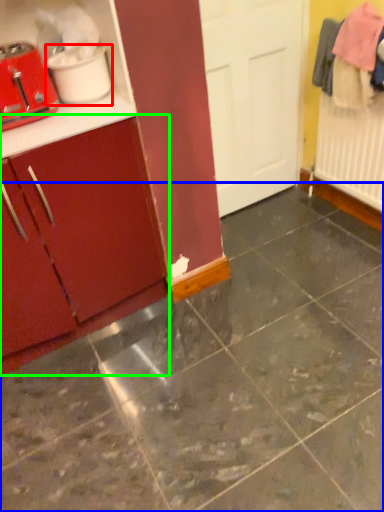
Question: Estimate the real-world distances between objects in this image. Which object is closer to appliance (highlighted by a red box), concrete (highlighted by a blue box) or cabinetry (highlighted by a green box)?

Choices:
 (A) concrete
 (B) cabinetry

Answer: (B)